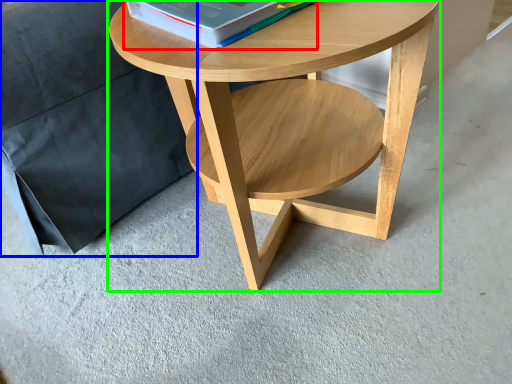
Question: Estimate the real-world distances between objects in this image. Which object is closer to paperback book (highlighted by a red box), pillow (highlighted by a blue box) or coffee table (highlighted by a green box)?

Choices:
 (A) pillow
 (B) coffee table

Answer: (B)